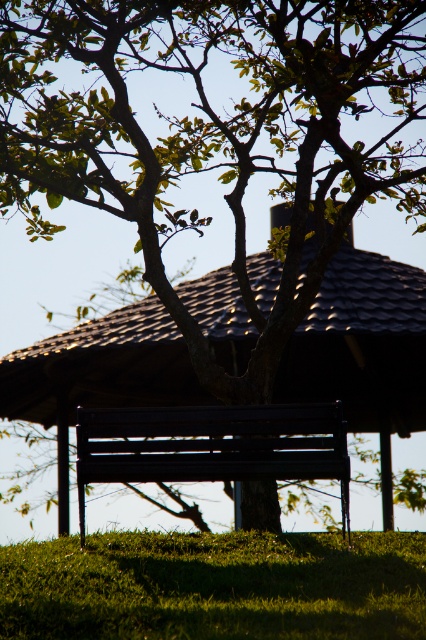
Between green grassy at lower center and matte black bench at center, which one has more height?

matte black bench at center is taller.

Does point (161, 634) come closer to viewer compared to point (250, 440)?

Yes, point (161, 634) is in front of point (250, 440).

Find the location of a particular element. This screenshot has width=426, height=640. green grassy at lower center is located at coordinates (215, 586).